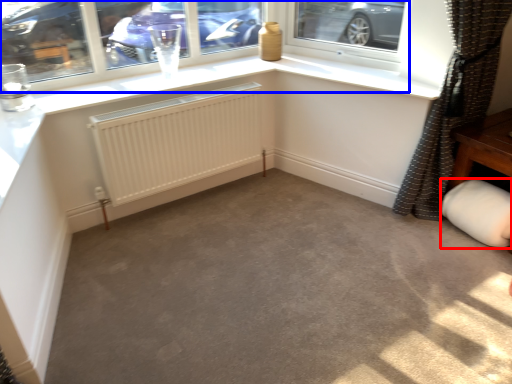
Question: Which of the following is the farthest to the observer, gray (highlighted by a red box) or window (highlighted by a blue box)?

Choices:
 (A) gray
 (B) window

Answer: (A)